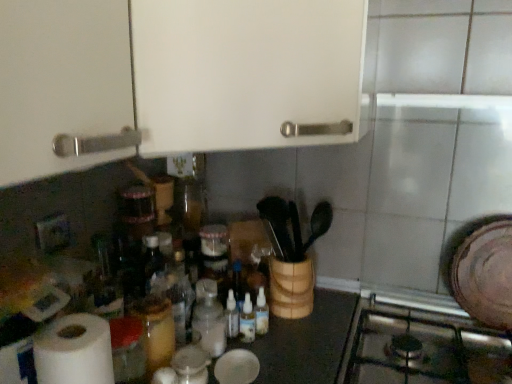
Question: In terms of size, does translucent plastic bottle at center, the second bottle in the left-to-right sequence, appear bigger or smaller than translucent glass jar at center, positioned as the fourth bottle in right-to-left order?

Choices:
 (A) big
 (B) small

Answer: (B)

Question: Is translucent plastic bottle at center, the second bottle in the left-to-right sequence, wider or thinner than translucent glass jar at center, arranged as the 1th bottle when viewed from the left?

Choices:
 (A) wide
 (B) thin

Answer: (B)

Question: Considering the real-world distances, which object is closest to the translucent plastic bottles at center, which appears as the 2th bottle when viewed from the right?

Choices:
 (A) translucent plastic bottles at center, which ranks as the 4th bottle in left-to-right order
 (B) translucent glass jar at center, positioned as the fourth bottle in right-to-left order
 (C) white matte cabinet at upper center
 (D) translucent plastic bottle at center, which is the third bottle from right to left
 (E) stainless steel gas stove at lower right

Answer: (A)

Question: Which of these objects is positioned closest to the white matte paper towel at lower left?

Choices:
 (A) translucent plastic bottle at center, the second bottle in the left-to-right sequence
 (B) translucent glass jar at center, arranged as the 1th bottle when viewed from the left
 (C) translucent plastic bottles at center, arranged as the first bottle when viewed from the right
 (D) translucent plastic bottles at center, which appears as the 2th bottle when viewed from the right
 (E) stainless steel gas stove at lower right

Answer: (B)